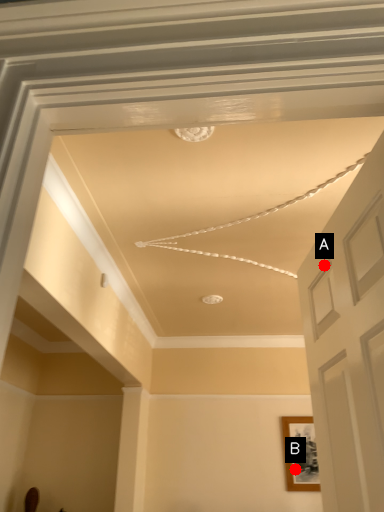
Question: Two points are circled on the image, labeled by A and B beside each circle. Among these points, which one is farthest from the camera?

Choices:
 (A) A is further
 (B) B is further

Answer: (B)